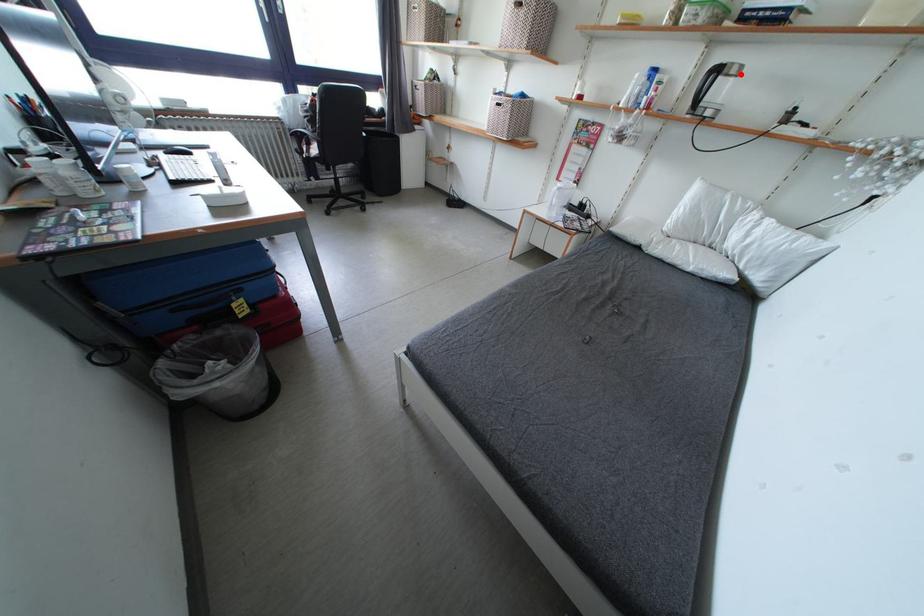
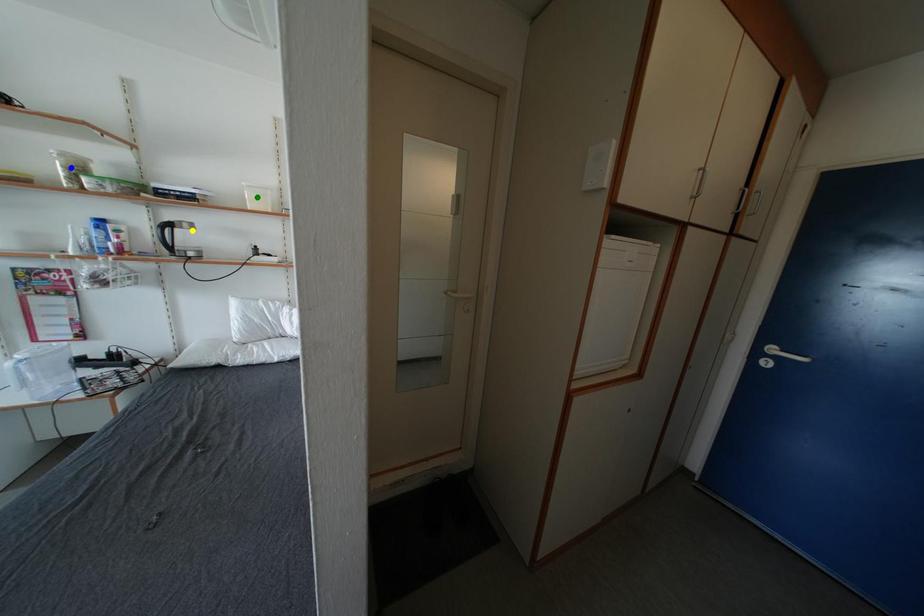
Question: I am providing you with two images of the same scene from different viewpoints. A red point is marked on the first image. You are given multiple points on the second image. Which point in image 2 represents the same 3d spot as the red point in image 1?

Choices:
 (A) blue point
 (B) green point
 (C) yellow point

Answer: (C)